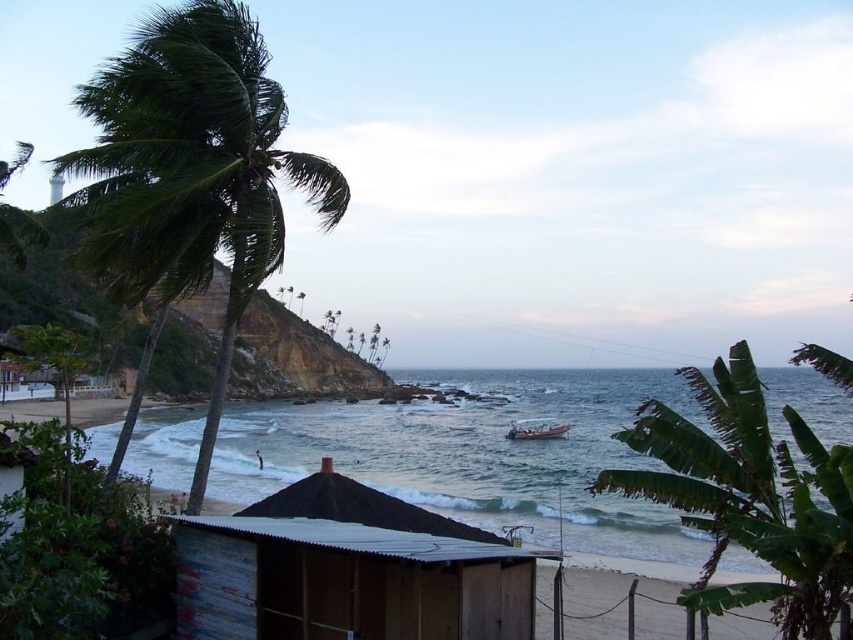
You are a photographer planning to take a sunset photo of the rusty corrugated metal hut at center and the metallic silver boat at center. Which object should you focus on first if you want to capture both in a single frame without moving the camera?

The rusty corrugated metal hut at center is shorter than the metallic silver boat at center, so you should focus on the metallic silver boat at center first to ensure both are in the frame.

You are standing on the beach and want to take a photo of the clear blue water at center. Where should you aim your camera to capture it?

The clear blue water at center is located at coordinates point (479, 456), so aim your camera there to capture it.